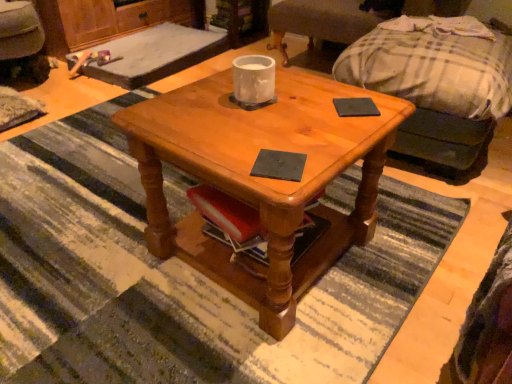
Find the location of `free space behind black matte coaster at center, the 1th pad from the bottom`. free space behind black matte coaster at center, the 1th pad from the bottom is located at coordinates (280, 130).